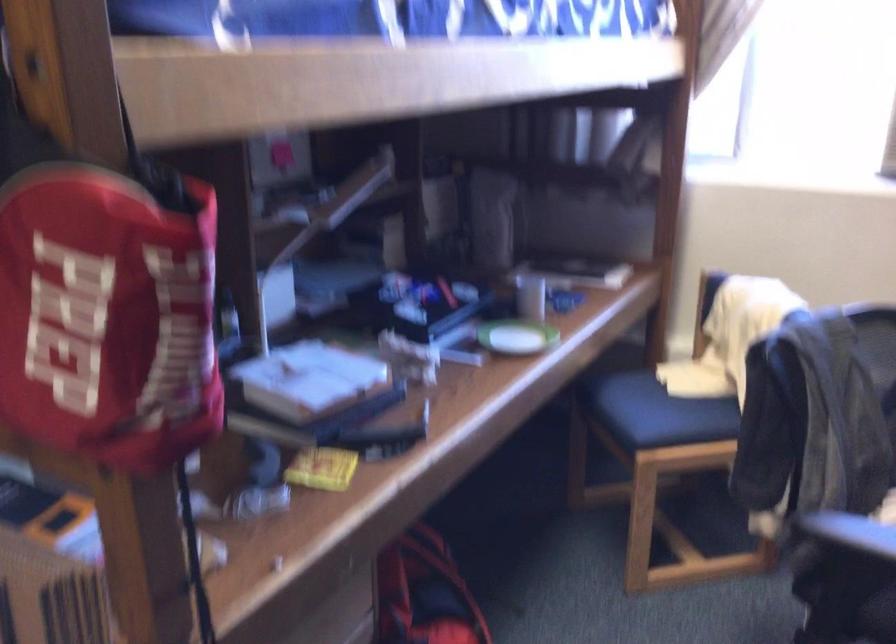
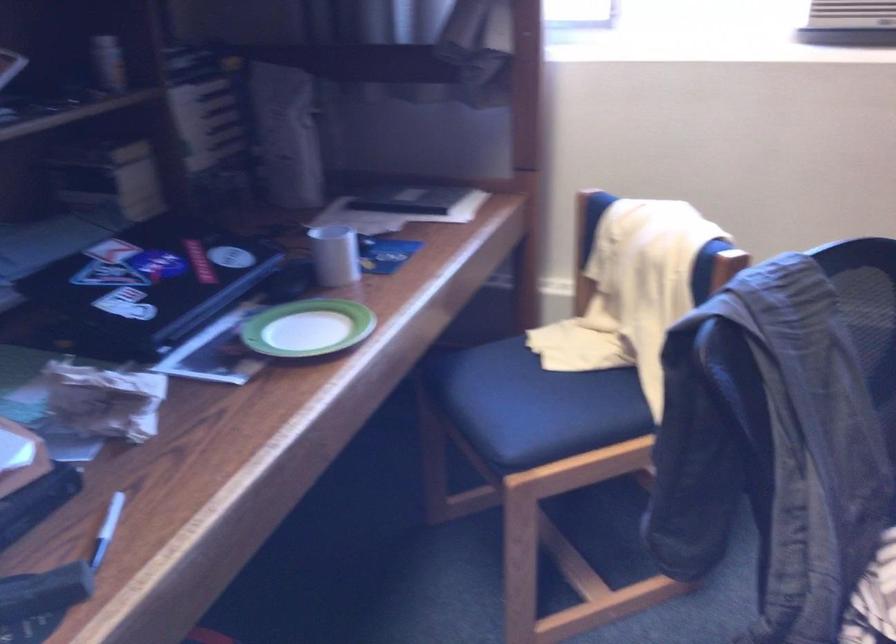
In the second image, find the point that corresponds to pixel 688 406 in the first image.

(576, 393)